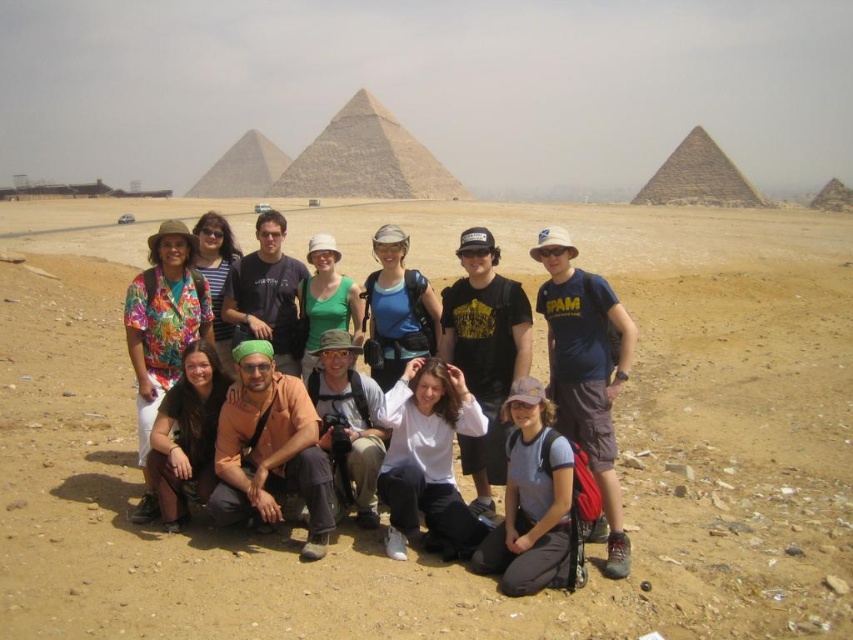
Which is more to the left, granite pyramid at center or floral fabric shirt at center?

granite pyramid at center

Based on the photo, between granite pyramid at center and floral fabric shirt at center, which one has more height?

granite pyramid at center is taller.

The width and height of the screenshot is (853, 640). What do you see at coordinates (366, 160) in the screenshot?
I see `granite pyramid at center` at bounding box center [366, 160].

The width and height of the screenshot is (853, 640). I want to click on granite pyramid at center, so click(x=366, y=160).

Who is higher up, floral fabric shirt at left or granite pyramid at center?

Answer: granite pyramid at center

Where is `floral fabric shirt at left`? Image resolution: width=853 pixels, height=640 pixels. floral fabric shirt at left is located at coordinates (161, 332).

Between gray fabric shirt at lower center and brown fabric pants at lower left, which one is positioned lower?

gray fabric shirt at lower center is lower down.

Between gray fabric shirt at lower center and brown fabric pants at lower left, which one has more height?

gray fabric shirt at lower center

This screenshot has width=853, height=640. Identify the location of gray fabric shirt at lower center. (532, 502).

Identify the location of gray fabric shirt at lower center. This screenshot has height=640, width=853. click(x=532, y=502).